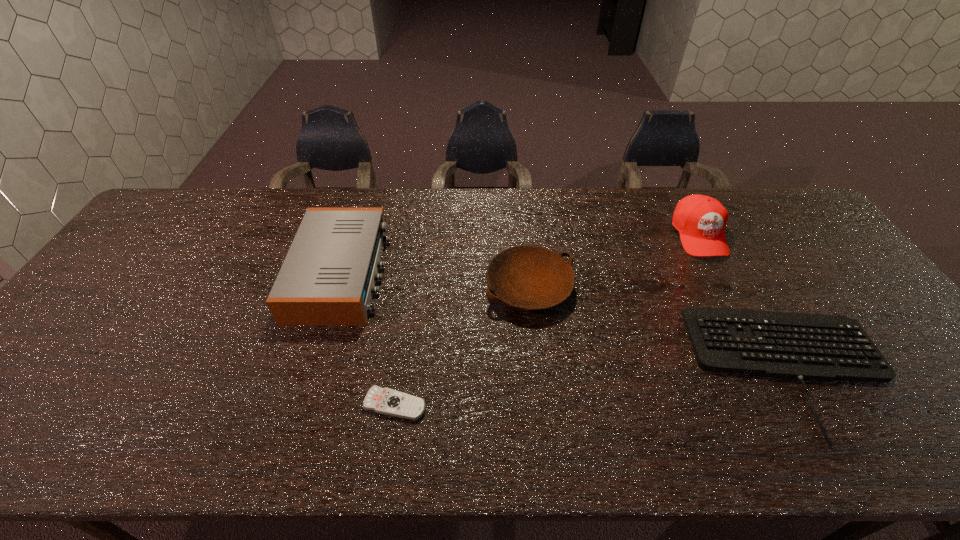
In order to click on empty space that is in between the remote control and the plate in this screenshot , I will do `click(463, 346)`.

The height and width of the screenshot is (540, 960). In order to click on free area in between the tallest object and the plate in this screenshot , I will do `click(614, 261)`.

Find the location of a particular element. Image resolution: width=960 pixels, height=540 pixels. vacant space that's between the tallest object and the remote control is located at coordinates (547, 320).

Locate an element on the screen. The image size is (960, 540). free space that is in between the second tallest object and the third tallest object is located at coordinates (436, 280).

Find the location of a particular element. The height and width of the screenshot is (540, 960). vacant region between the shortest object and the third object from right to left is located at coordinates (463, 346).

Identify which object is the second closest to the computer keyboard. Please provide its 2D coordinates. Your answer should be formatted as a tuple, i.e. [(x, y)], where the tuple contains the x and y coordinates of a point satisfying the conditions above.

[(529, 277)]

Select which object appears as the fourth closest to the second tallest object. Please provide its 2D coordinates. Your answer should be formatted as a tuple, i.e. [(x, y)], where the tuple contains the x and y coordinates of a point satisfying the conditions above.

[(701, 220)]

Find the location of `free space that satisfies the following two spatial constraints: 1. on the front panel of the radio receiver; 2. on the right side of the third object from left to right`. free space that satisfies the following two spatial constraints: 1. on the front panel of the radio receiver; 2. on the right side of the third object from left to right is located at coordinates (337, 287).

You are a GUI agent. You are given a task and a screenshot of the screen. Output one action in this format:
    pyautogui.click(x=<x>, y=<y>)
    Task: Click on the blank space that satisfies the following two spatial constraints: 1. on the front panel of the remote control; 2. on the right side of the radio receiver
    
    Given the screenshot: What is the action you would take?
    pyautogui.click(x=301, y=404)

You are a GUI agent. You are given a task and a screenshot of the screen. Output one action in this format:
    pyautogui.click(x=<x>, y=<y>)
    Task: Click on the free region that satisfies the following two spatial constraints: 1. on the front panel of the plate; 2. on the left side of the leftmost object
    
    Given the screenshot: What is the action you would take?
    pyautogui.click(x=337, y=287)